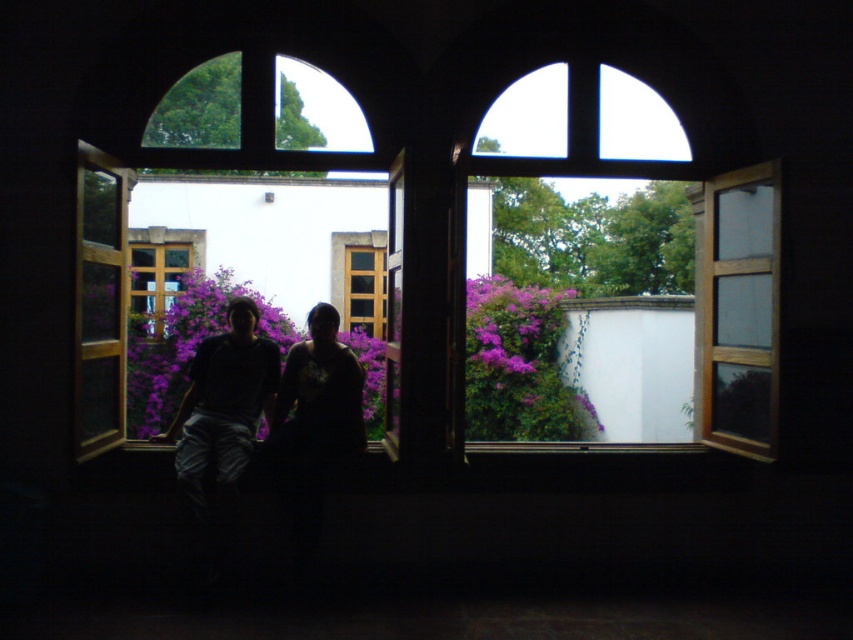
Question: Does purple matte flowers at center appear under matte black shirt at center?

Choices:
 (A) yes
 (B) no

Answer: (B)

Question: Is dark clothing at center below matte black shirt at center?

Choices:
 (A) no
 (B) yes

Answer: (B)

Question: Can you confirm if dark clothing at center is thinner than matte black shirt at center?

Choices:
 (A) no
 (B) yes

Answer: (A)

Question: Which point is farther to the camera?

Choices:
 (A) matte black shirt at center
 (B) purple matte flowers at center

Answer: (B)

Question: Which point is farther to the camera?

Choices:
 (A) (315, 328)
 (B) (258, 387)

Answer: (B)

Question: Which point appears closest to the camera in this image?

Choices:
 (A) (189, 381)
 (B) (341, 340)

Answer: (A)